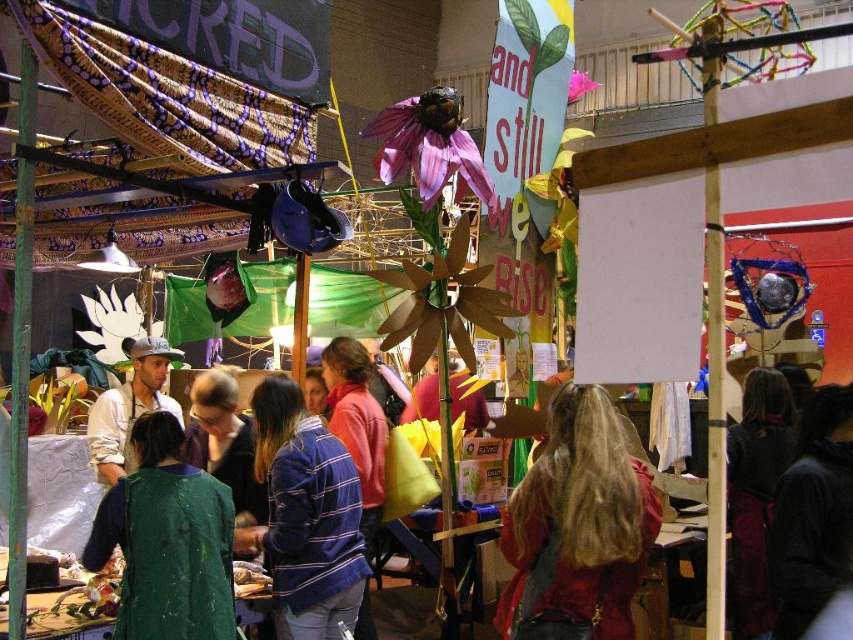
You are a vendor at the market and need to place a small decorative item that is 15 cm wide. You have two options for placement spots near the green fabric jacket at lower left and the matte white cap at center. Which location has enough space to accommodate the item without overlapping?

The green fabric jacket at lower left might be wider than matte white cap at center, so the spot near the green fabric jacket at lower left likely has more space and can accommodate the 15 cm wide item without overlapping.

You are standing at the entrance of the market and want to take a photo of the point at coordinates point (283, 387). Can you estimate how far you need to walk to reach that point?

The distance of point (283, 387) from camera is 23.29 feet, so you need to walk approximately 23.29 feet to reach it.